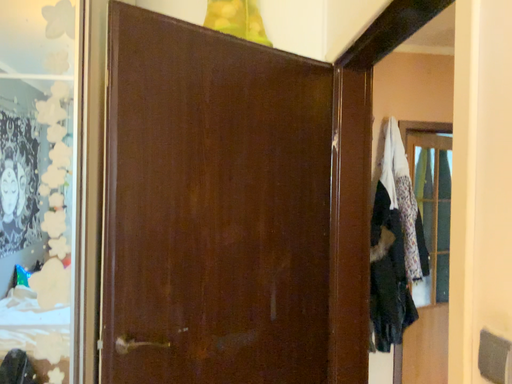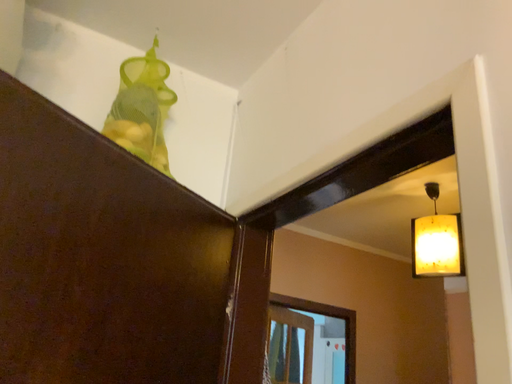
Question: How did the camera likely rotate when shooting the video?

Choices:
 (A) rotated right
 (B) rotated left

Answer: (A)